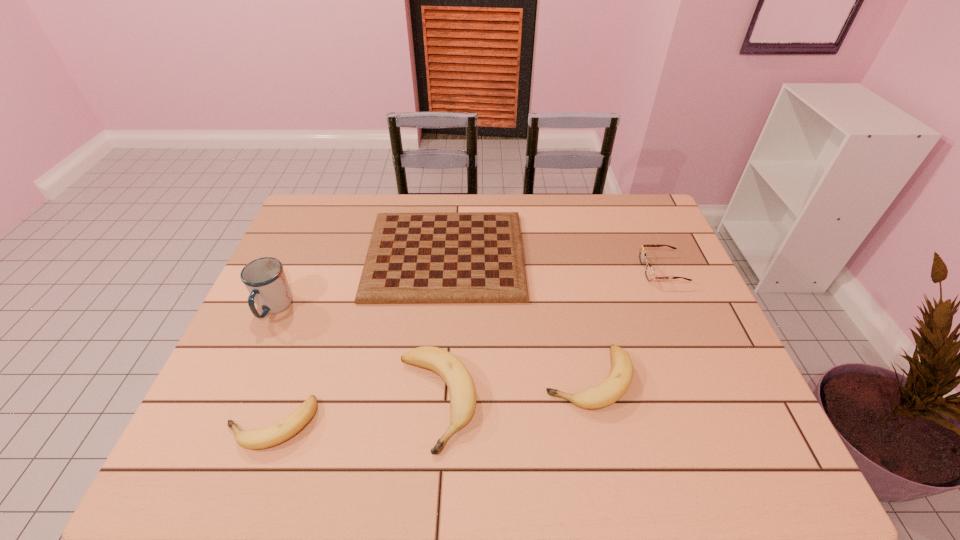
Where is `vacant space at the far edge`? vacant space at the far edge is located at coordinates (396, 210).

This screenshot has height=540, width=960. I want to click on free space at the near edge of the desktop, so click(x=375, y=417).

In the image, there is a desktop. At what (x,y) coordinates should I click in order to perform the action: click on free space at the left edge. Please return your answer as a coordinate pair (x, y). The height and width of the screenshot is (540, 960). Looking at the image, I should click on (273, 337).

Where is `vacant area at the right edge of the desktop`? The width and height of the screenshot is (960, 540). vacant area at the right edge of the desktop is located at coordinates (708, 314).

Locate an element on the screen. Image resolution: width=960 pixels, height=540 pixels. vacant region at the near left corner is located at coordinates (206, 418).

Find the location of a particular element. vacant point located between the gameboard and the tallest object is located at coordinates (360, 281).

Image resolution: width=960 pixels, height=540 pixels. I want to click on empty space between the leftmost banana and the gameboard, so click(358, 340).

You are a GUI agent. You are given a task and a screenshot of the screen. Output one action in this format:
    pyautogui.click(x=<x>, y=<y>)
    Task: Click on the vacant area that lies between the spectacles and the shortest banana
    
    Given the screenshot: What is the action you would take?
    pyautogui.click(x=467, y=347)

Locate an element on the screen. Image resolution: width=960 pixels, height=540 pixels. vacant area between the spectacles and the leftmost banana is located at coordinates (467, 347).

I want to click on vacant space in between the second tallest banana and the tallest object, so click(431, 343).